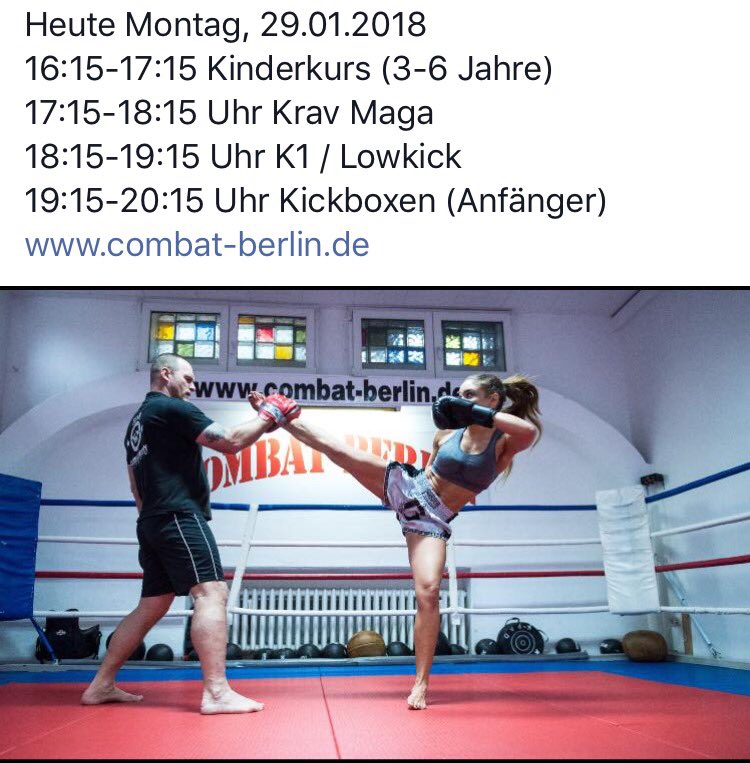
You are a GUI agent. You are given a task and a screenshot of the screen. Output one action in this format:
    pyautogui.click(x=<x>, y=<y>)
    Task: Click on the stained glass window
    The height and width of the screenshot is (763, 750).
    Given the screenshot: What is the action you would take?
    pyautogui.click(x=280, y=337)